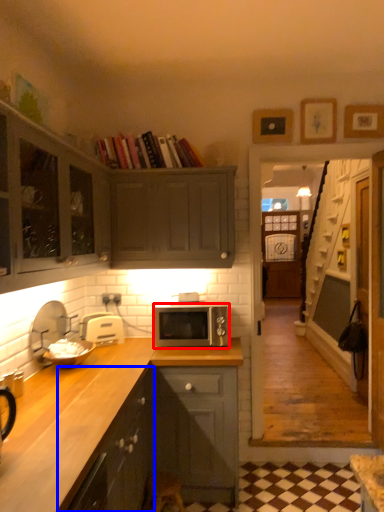
Question: Which point is closer to the camera, microwave oven (highlighted by a red box) or cabinetry (highlighted by a blue box)?

Choices:
 (A) microwave oven
 (B) cabinetry

Answer: (B)